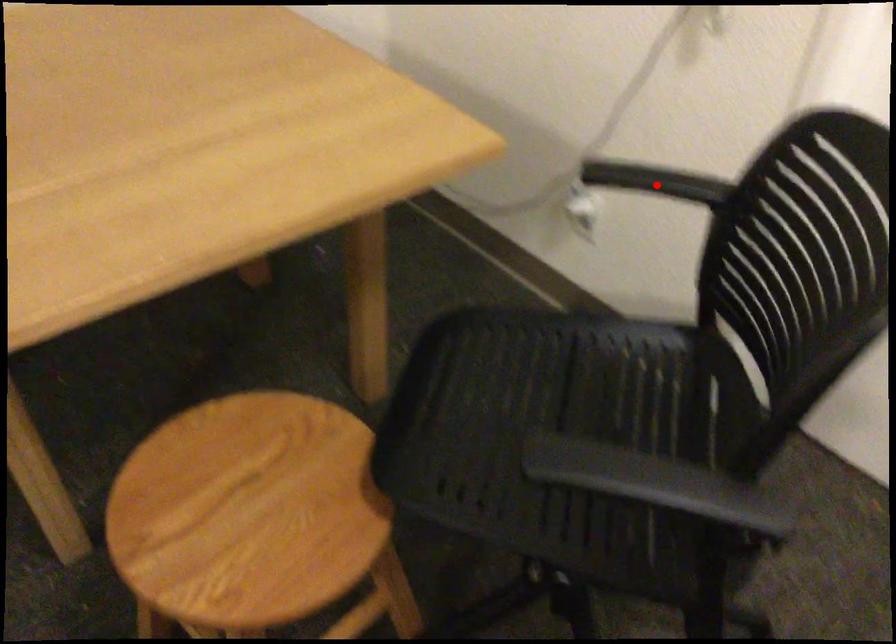
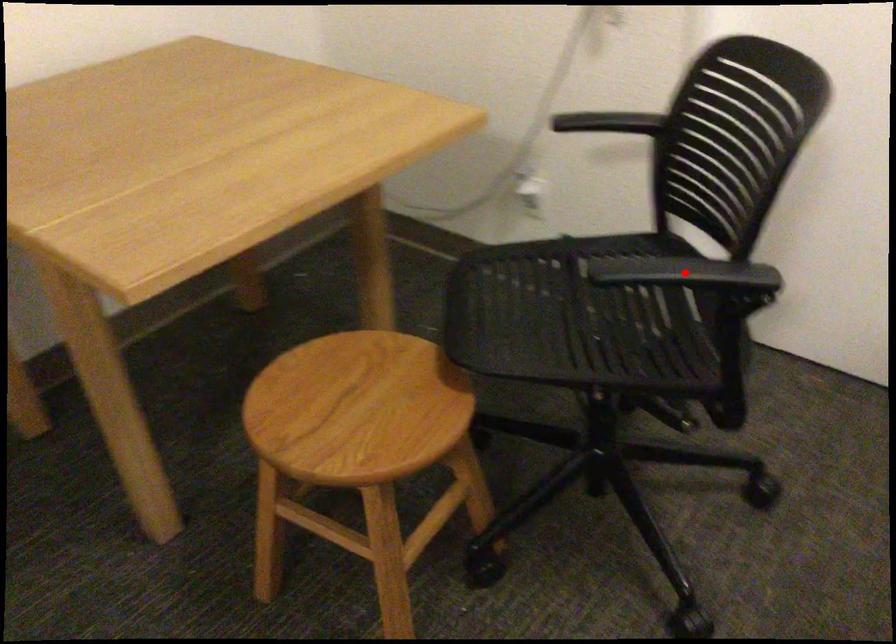
I am providing you with two images of the same scene from different viewpoints. A red point is marked on the first image and another point is marked on the second image. Do the highlighted points in image1 and image2 indicate the same real-world spot?

No